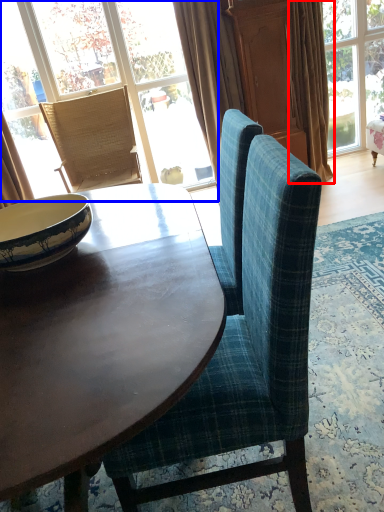
Question: Which of the following is the farthest to the observer, curtain (highlighted by a red box) or window (highlighted by a blue box)?

Choices:
 (A) curtain
 (B) window

Answer: (B)